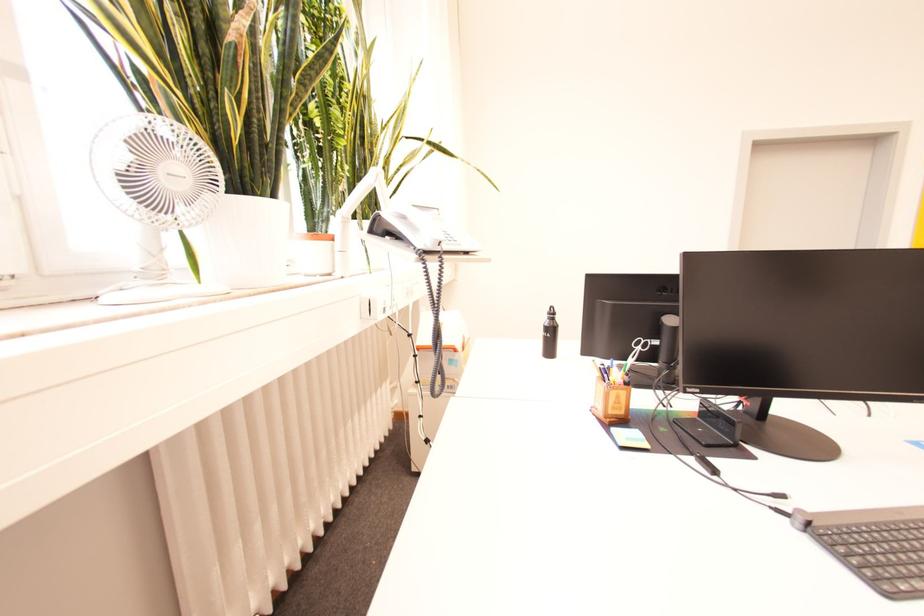
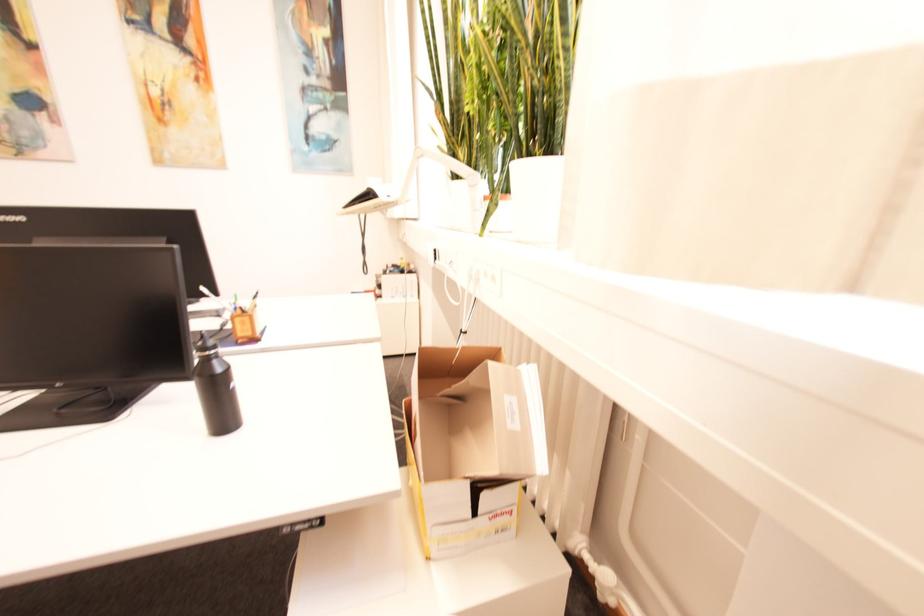
Question: I am providing you with two images of the same scene from different viewpoints. Which of the following objects are not visible in image2?

Choices:
 (A) black water bottle
 (B) white kettle handle
 (C) telephone handset
 (D) stack of papers

Answer: (A)